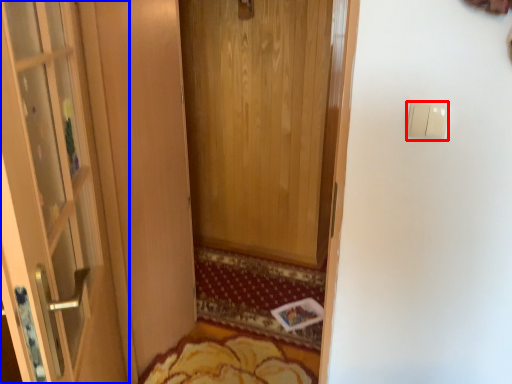
Question: Which of the following is the closest to the observer, light switch (highlighted by a red box) or door (highlighted by a blue box)?

Choices:
 (A) light switch
 (B) door

Answer: (B)